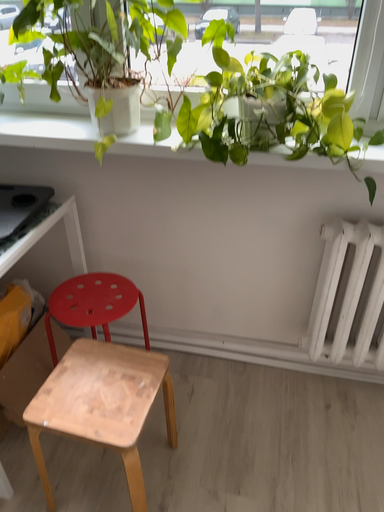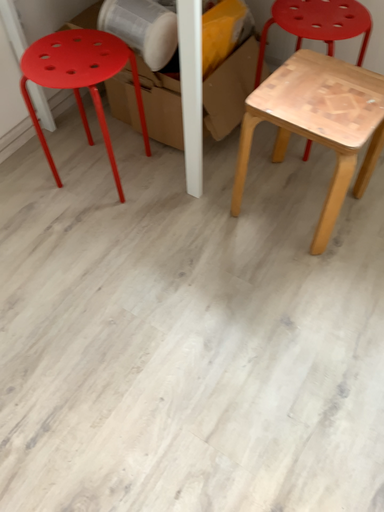
Question: How did the camera likely rotate when shooting the video?

Choices:
 (A) rotated right
 (B) rotated left

Answer: (B)